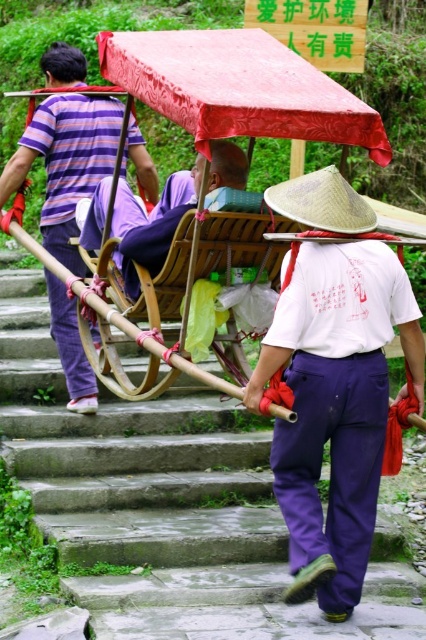
Question: Can you confirm if white cotton shirt at center is positioned to the left of purple cotton pants at center?

Choices:
 (A) no
 (B) yes

Answer: (A)

Question: Can you confirm if white cotton shirt at center is smaller than purple cotton pants at center?

Choices:
 (A) no
 (B) yes

Answer: (B)

Question: From the image, what is the correct spatial relationship of purple striped shirt at upper left in relation to purple cotton pants at center?

Choices:
 (A) above
 (B) below

Answer: (B)

Question: Which object is positioned closest to the purple striped shirt at upper left?

Choices:
 (A) white cotton shirt at center
 (B) natural straw hat at center
 (C) wooden cart at center
 (D) purple cotton pants at center

Answer: (D)

Question: Among these objects, which one is nearest to the camera?

Choices:
 (A) natural straw hat at center
 (B) purple striped shirt at upper left
 (C) purple cotton pants at center

Answer: (A)

Question: Considering the real-world distances, which object is farthest from the wooden cart at center?

Choices:
 (A) natural straw hat at center
 (B) white cotton shirt at center
 (C) purple cotton pants at center
 (D) purple striped shirt at upper left

Answer: (D)